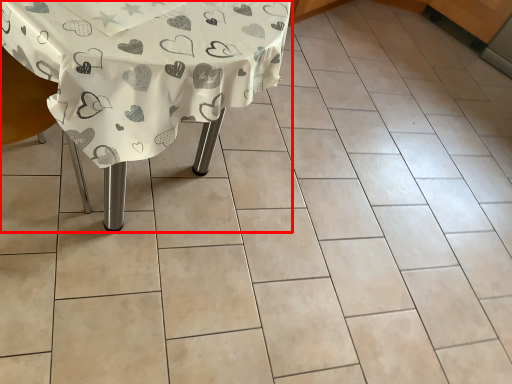
Question: From the image's perspective, considering the relative positions of table (annotated by the red box) and armchair in the image provided, where is table (annotated by the red box) located with respect to the staircase?

Choices:
 (A) above
 (B) below

Answer: (A)